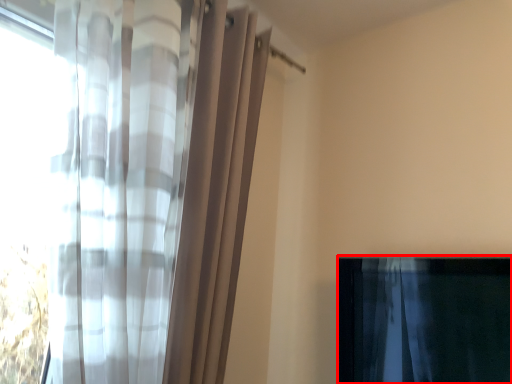
Question: From the image's perspective, where is curtain (annotated by the red box) located relative to curtain?

Choices:
 (A) below
 (B) above

Answer: (A)